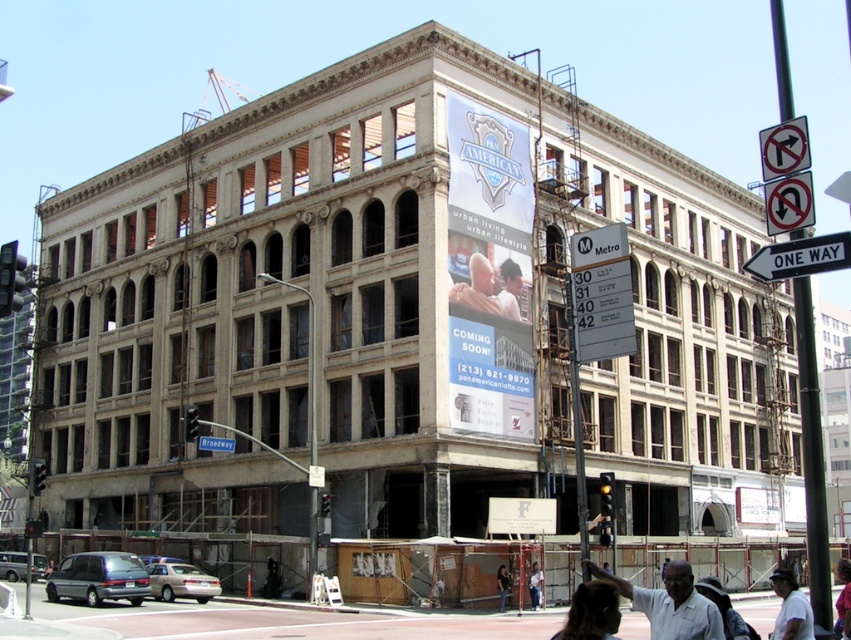
Is white cotton shirt at lower right smaller than blue metallic street sign at upper center?

No.

Does point (777, 576) lie in front of point (230, 451)?

Yes.

The height and width of the screenshot is (640, 851). What are the coordinates of `white cotton shirt at lower right` in the screenshot? It's located at (790, 609).

Is point (804, 634) closer to viewer compared to point (503, 611)?

That is True.

Based on the photo, is white cotton shirt at lower right positioned before light brown leather jacket at lower center?

Yes.

The width and height of the screenshot is (851, 640). Find the location of `white cotton shirt at lower right`. white cotton shirt at lower right is located at coordinates (790, 609).

From the picture: Does light gray shirt at lower right have a lesser height compared to white paper sign at center?

Incorrect, light gray shirt at lower right's height does not fall short of white paper sign at center's.

Which is more to the right, light gray shirt at lower right or white paper sign at center?

light gray shirt at lower right is more to the right.

At what (x,y) coordinates should I click in order to perform the action: click on light gray shirt at lower right. Please return your answer as a coordinate pair (x, y). The height and width of the screenshot is (640, 851). Looking at the image, I should click on (670, 604).

Locate an element on the screen. The width and height of the screenshot is (851, 640). light gray shirt at lower right is located at coordinates (670, 604).